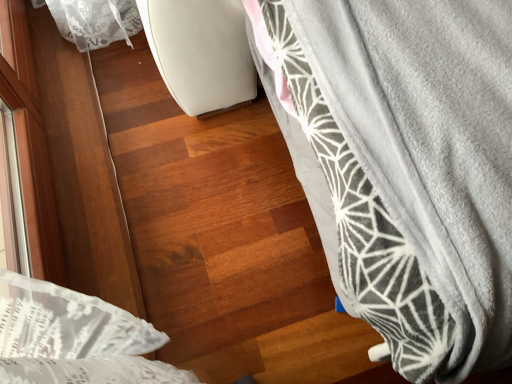
Where is `gray fleece blanket at right`? The width and height of the screenshot is (512, 384). gray fleece blanket at right is located at coordinates (404, 165).

Describe the element at coordinates (404, 165) in the screenshot. This screenshot has height=384, width=512. I see `gray fleece blanket at right` at that location.

Measure the distance between point (369, 245) and camera.

A distance of 24.72 inches exists between point (369, 245) and camera.

You are a GUI agent. You are given a task and a screenshot of the screen. Output one action in this format:
    pyautogui.click(x=<x>, y=<y>)
    Task: Click on the gray fleece blanket at right
    Image resolution: width=512 pixels, height=384 pixels.
    Given the screenshot: What is the action you would take?
    pyautogui.click(x=404, y=165)